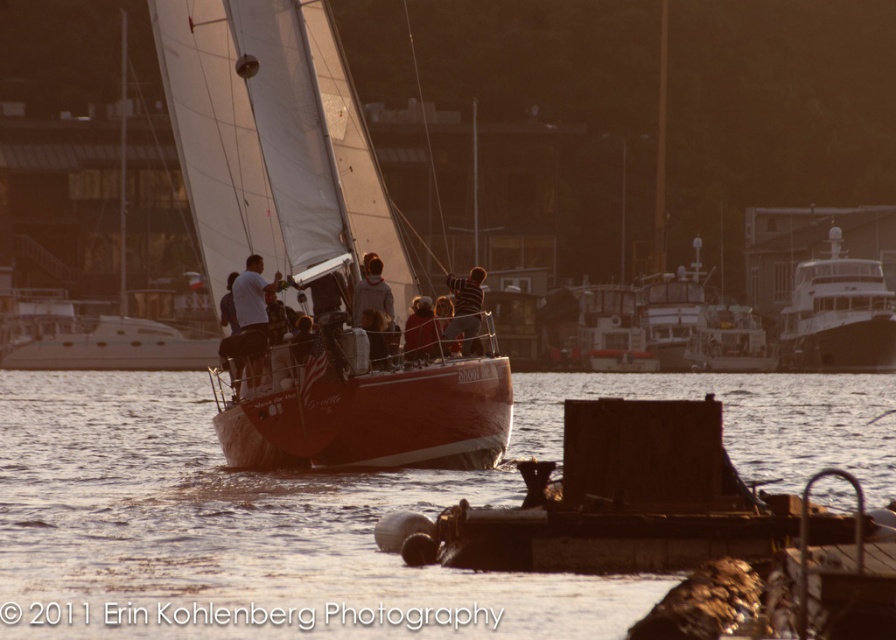
Question: Based on their relative distances, which object is nearer to the shiny red sailboat at center?

Choices:
 (A) rustic wood dock at lower center
 (B) translucent water at lower center
 (C) shiny silver yacht at right
 (D) striped fabric shirt at center

Answer: (D)

Question: Is translucent water at lower center further to the viewer compared to light gray sweater at center?

Choices:
 (A) no
 (B) yes

Answer: (A)

Question: Does translucent water at lower center have a larger size compared to metallic silver boat at center?

Choices:
 (A) yes
 (B) no

Answer: (A)

Question: Based on their relative distances, which object is nearer to the shiny silver yacht at right?

Choices:
 (A) white glossy boat at center
 (B) translucent water at lower center
 (C) white fabric shirt at center
 (D) metallic silver boat at center

Answer: (A)

Question: Among these points, which one is farthest from the camera?

Choices:
 (A) (432, 342)
 (B) (583, 428)
 (C) (52, 620)

Answer: (A)

Question: Does shiny silver yacht at right have a lesser width compared to white fabric shirt at center?

Choices:
 (A) no
 (B) yes

Answer: (A)